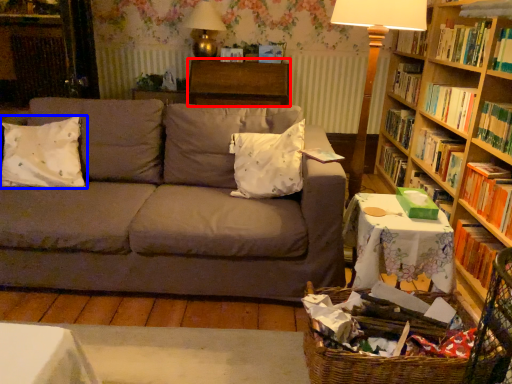
Question: Which object is further to the camera taking this photo, table (highlighted by a red box) or pillow (highlighted by a blue box)?

Choices:
 (A) table
 (B) pillow

Answer: (A)